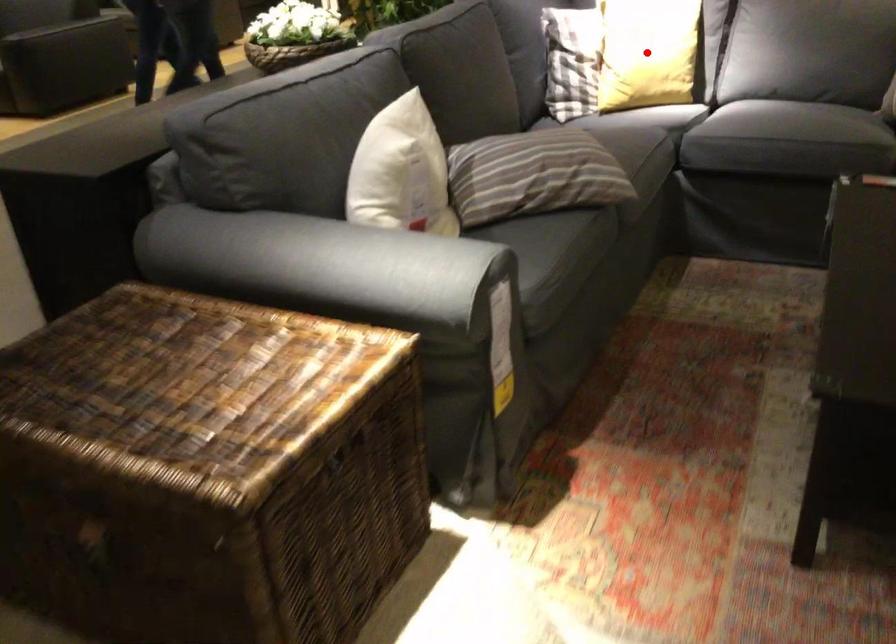
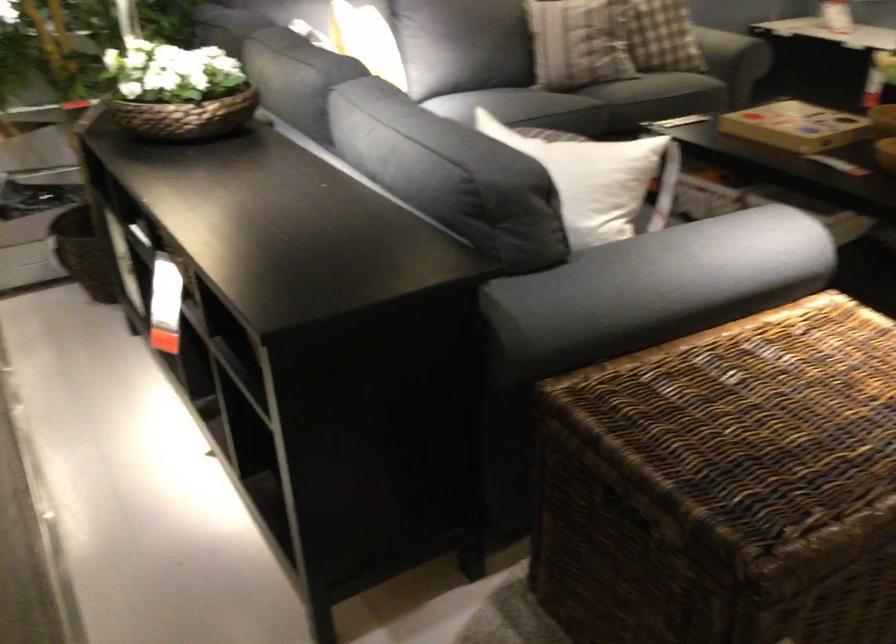
Question: I am providing you with two images of the same scene from different viewpoints. A red point is marked on the first image. Is the red point's position out of view in image 2?

Choices:
 (A) Yes
 (B) No

Answer: (A)